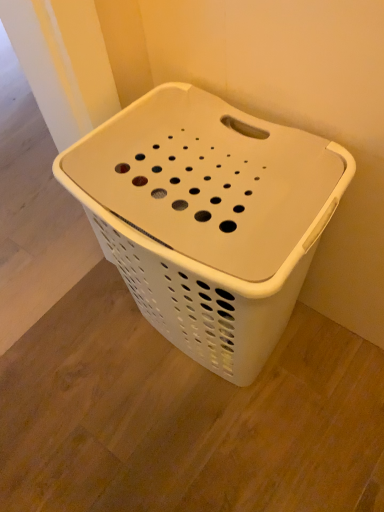
Image resolution: width=384 pixels, height=512 pixels. Describe the element at coordinates (208, 218) in the screenshot. I see `white plastic laundry basket at center` at that location.

You are a GUI agent. You are given a task and a screenshot of the screen. Output one action in this format:
    pyautogui.click(x=<x>, y=<y>)
    Task: Click on the white plastic laundry basket at center
    The image size is (384, 512).
    Given the screenshot: What is the action you would take?
    pyautogui.click(x=208, y=218)

You are a GUI agent. You are given a task and a screenshot of the screen. Output one action in this format:
    pyautogui.click(x=<x>, y=<y>)
    Task: Click on the white plastic laundry basket at center
    
    Given the screenshot: What is the action you would take?
    pyautogui.click(x=208, y=218)